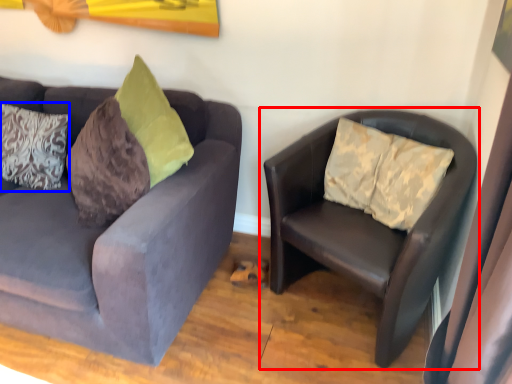
Question: Among these objects, which one is farthest to the camera, studio couch (highlighted by a red box) or pillow (highlighted by a blue box)?

Choices:
 (A) studio couch
 (B) pillow

Answer: (B)